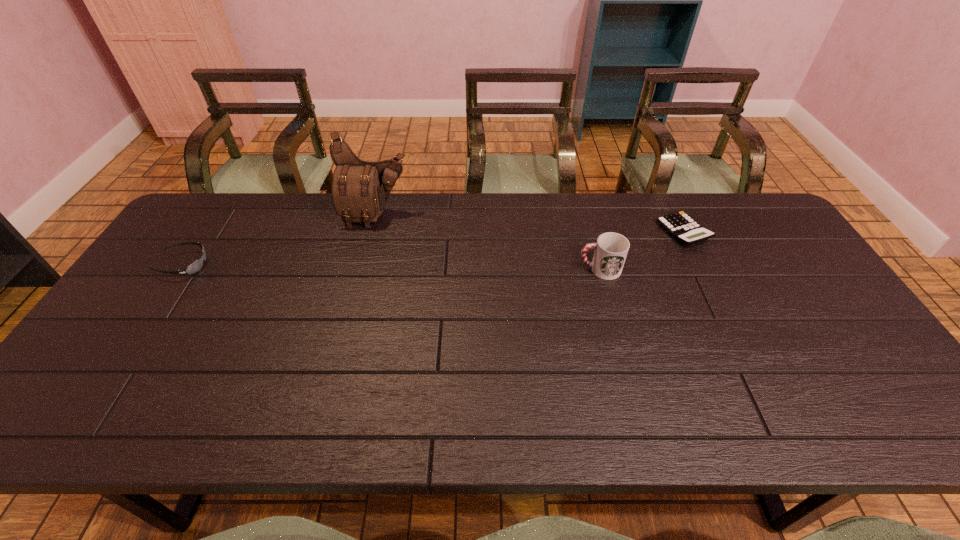
In order to click on the second object from left to right in this screenshot , I will do `click(360, 189)`.

Find the location of a particular element. shoulder bag is located at coordinates (360, 189).

Identify the location of the second object from right to left. This screenshot has width=960, height=540. 611,249.

The width and height of the screenshot is (960, 540). I want to click on the third shortest object, so click(611, 249).

At what (x,y) coordinates should I click in order to perform the action: click on the leftmost object. Please return your answer as a coordinate pair (x, y). The image size is (960, 540). Looking at the image, I should click on (189, 270).

Identify the location of the second shortest object. This screenshot has height=540, width=960. (189, 270).

Find the location of a particular element. the rightmost object is located at coordinates (682, 227).

This screenshot has height=540, width=960. In order to click on calculator in this screenshot , I will do `click(682, 227)`.

This screenshot has height=540, width=960. Find the location of `vacant space located on the front-facing side of the shoulder bag`. vacant space located on the front-facing side of the shoulder bag is located at coordinates (365, 257).

Locate an element on the screen. The image size is (960, 540). vacant area situated on the handle side of the second object from right to left is located at coordinates coord(561,269).